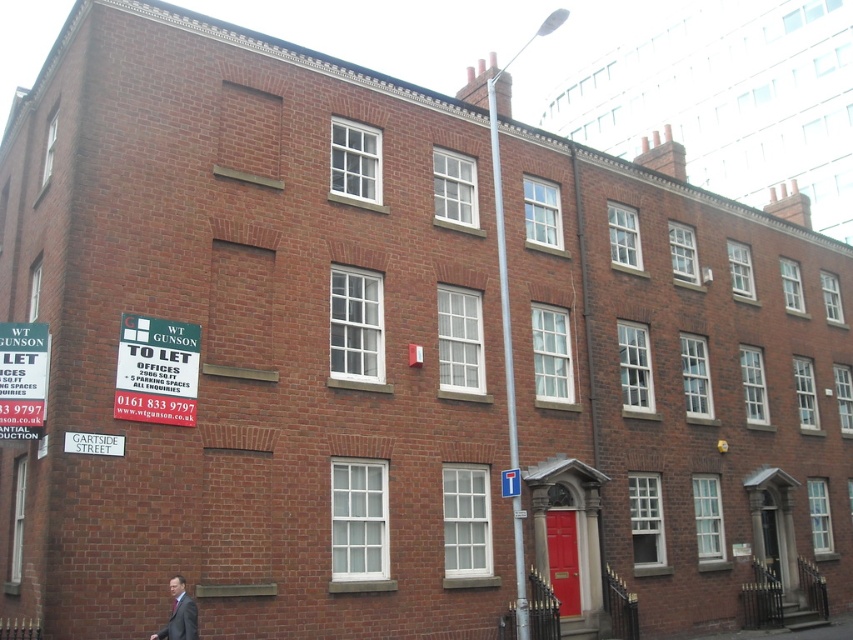
Is white paper sign at upper left smaller than matte gray suit at lower left?

Actually, white paper sign at upper left might be larger than matte gray suit at lower left.

Which is in front, point (35, 401) or point (173, 621)?

Positioned in front is point (173, 621).

I want to click on white paper sign at upper left, so click(22, 378).

Is matte gray suit at lower left below white plastic street sign at lower left?

Correct, matte gray suit at lower left is located below white plastic street sign at lower left.

In the scene shown: How much distance is there between matte gray suit at lower left and white plastic street sign at lower left?

matte gray suit at lower left and white plastic street sign at lower left are 17.36 feet apart from each other.

Find the location of `matte gray suit at lower left`. matte gray suit at lower left is located at coordinates (178, 612).

Does point (115, 384) come farther from viewer compared to point (36, 396)?

Yes, point (115, 384) is farther from viewer.

Is green plastic signboard at upper left closer to camera compared to white paper sign at upper left?

No, green plastic signboard at upper left is behind white paper sign at upper left.

Image resolution: width=853 pixels, height=640 pixels. In order to click on green plastic signboard at upper left in this screenshot , I will do point(155,371).